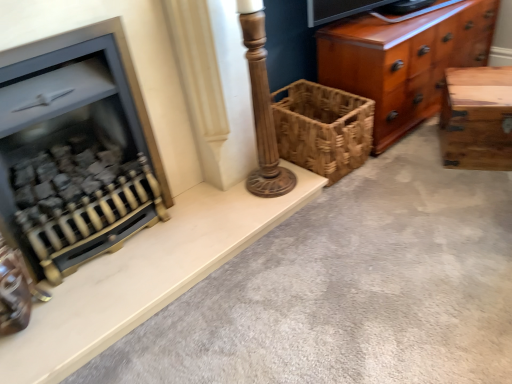
Where is `free space to the left of natural wood trunk at right`? This screenshot has width=512, height=384. free space to the left of natural wood trunk at right is located at coordinates [415, 157].